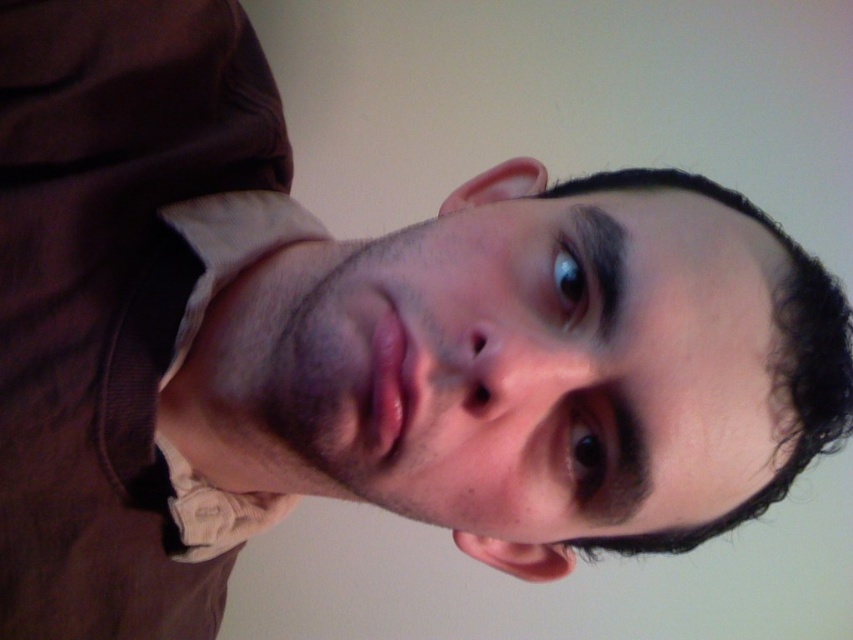
Based on the scene description, can you determine the spatial relationship between the smooth skin face at center and the white cotton dress shirt at left? Specifically, is the face positioned above or below the shirt?

The smooth skin face at center is located below the white cotton dress shirt at left, as stated in the objects description.

You are taking a photo of a person and notice two points in the image labeled as point (x=343, y=436) and point (x=173, y=33). Based on the scene description, which point is nearer to you?

Point (x=343, y=436) is closer to the viewer than point (x=173, y=33).

Based on the scene description, where exactly is the smooth skin face at center located in terms of coordinates?

The smooth skin face at center is located at coordinates point (546, 365).